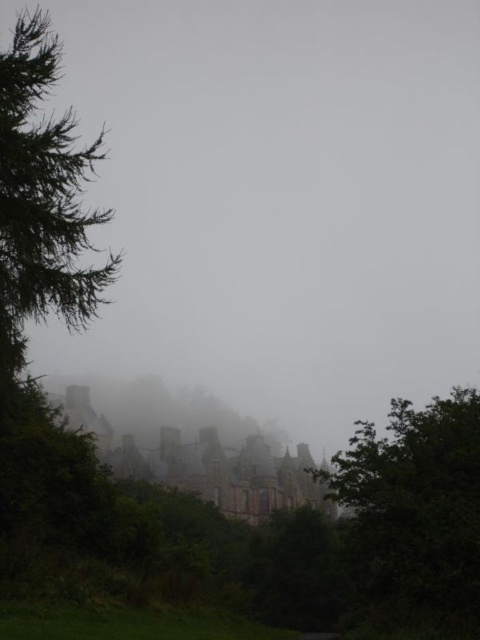
Consider the image. You are standing in a misty area and want to take a photo of the historic building without the foggy translucent cloud at center obstructing the view. Where should you move relative to the current position?

The foggy translucent cloud at center is located at coordinates point [279,200]. To avoid it, move your position away from these coordinates towards areas with lower fog density, such as the direction opposite to the cloud.

You are a landscape photographer planning to capture the historic building in the mist. You notice the foggy translucent cloud at center and the green leafy tree at lower right in your viewfinder. Which object occupies more horizontal space in the image?

The foggy translucent cloud at center occupies more horizontal space than the green leafy tree at lower right because its width surpasses the tree.